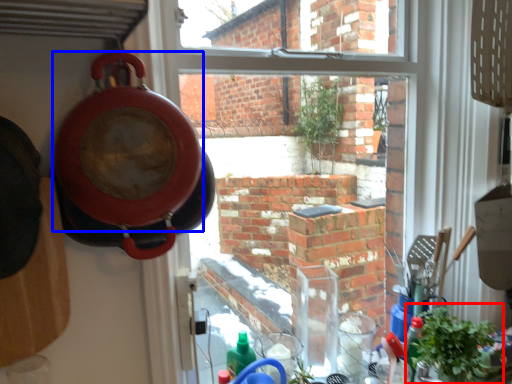
Question: Which point is further to the camera, houseplant (highlighted by a red box) or pizza pan (highlighted by a blue box)?

Choices:
 (A) houseplant
 (B) pizza pan

Answer: (A)